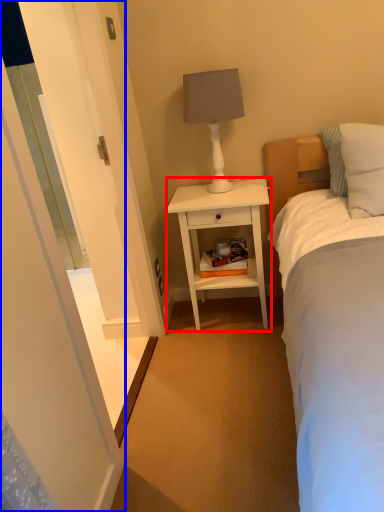
Question: Among these objects, which one is farthest to the camera, nightstand (highlighted by a red box) or screen door (highlighted by a blue box)?

Choices:
 (A) nightstand
 (B) screen door

Answer: (A)